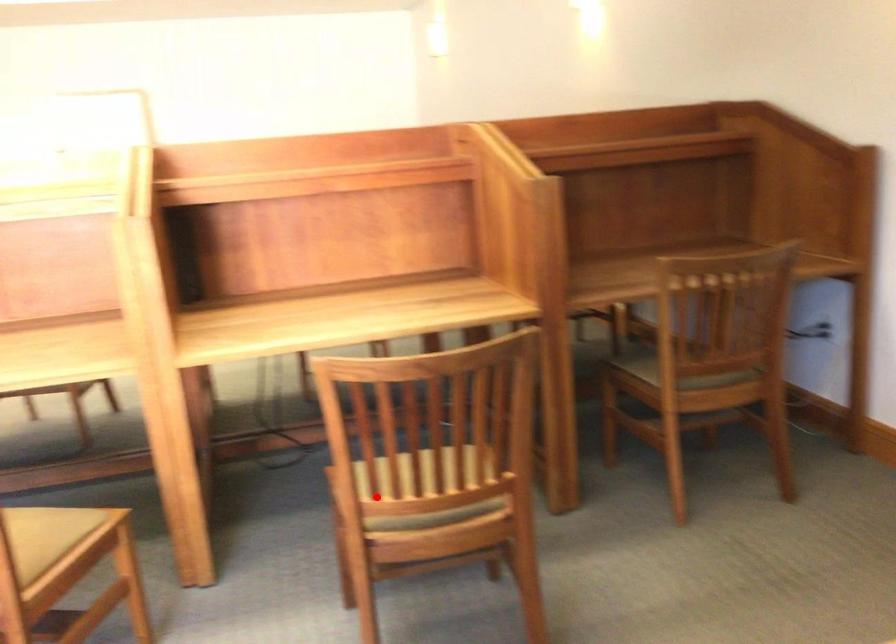
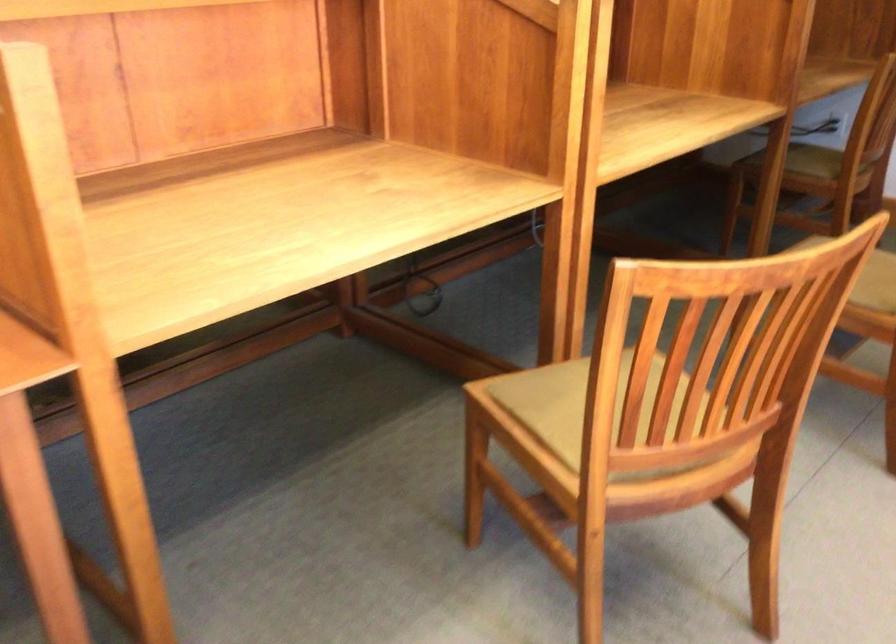
Question: I am providing you with two images of the same scene from different viewpoints. A red point is shown in image1. For the corresponding object point in image2, is it positioned nearer or farther from the camera?

Choices:
 (A) Nearer
 (B) Farther

Answer: (B)